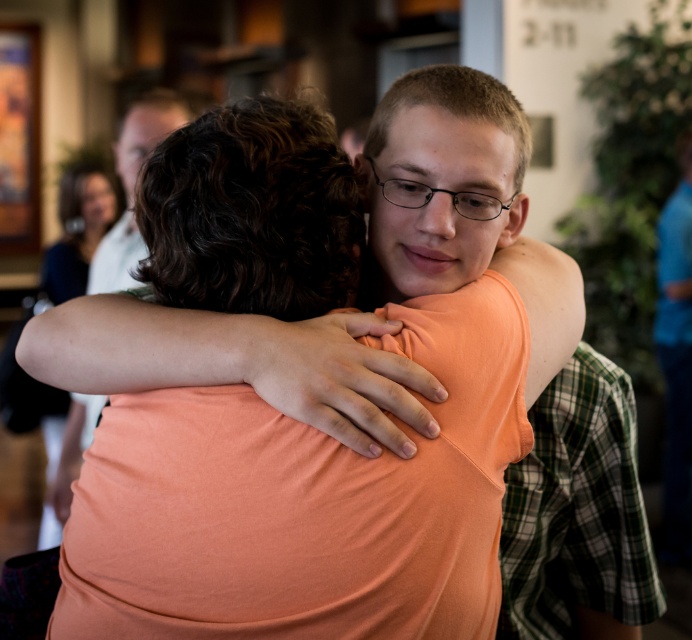
You are a photographer adjusting your camera settings to capture the best shot of the two people hugging. You notice the orange smooth arm at center and the orange fabric shirt at center. Which object should you focus on if you want to highlight the lower part of the scene?

The orange smooth arm at center is located below the orange fabric shirt at center, so focusing on the orange smooth arm at center will highlight the lower part of the scene.

You are a photographer adjusting the focus of your camera. The orange smooth arm at center is at coordinates 0.569, 0.345. If you want to focus on this arm, where should you adjust the focus point to?

The orange smooth arm at center is located at point (237, 364), so you should adjust the focus point to (237, 364) to focus on it.